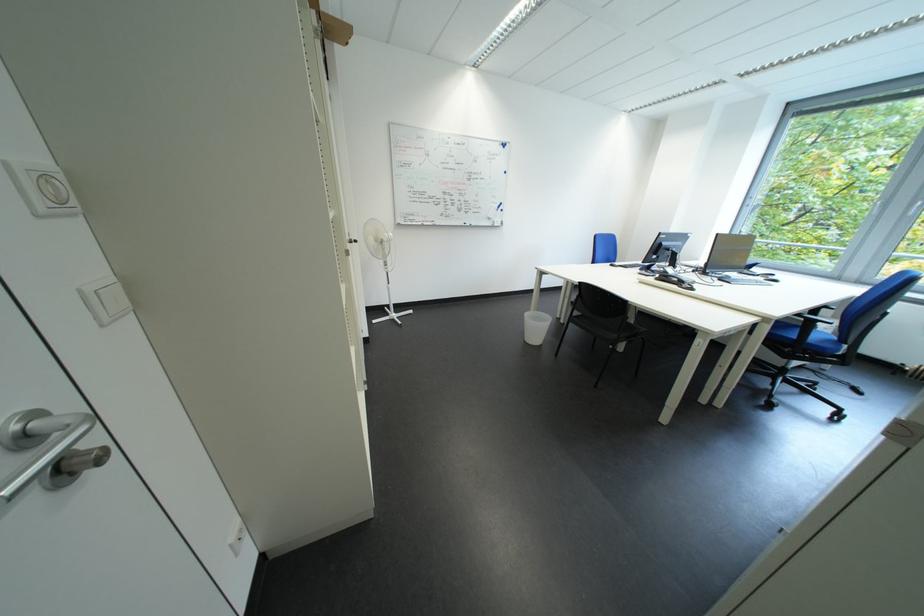
Find where to sit the black chair sitting surface. Please return your answer as a coordinate pair (x, y).

(606, 326)